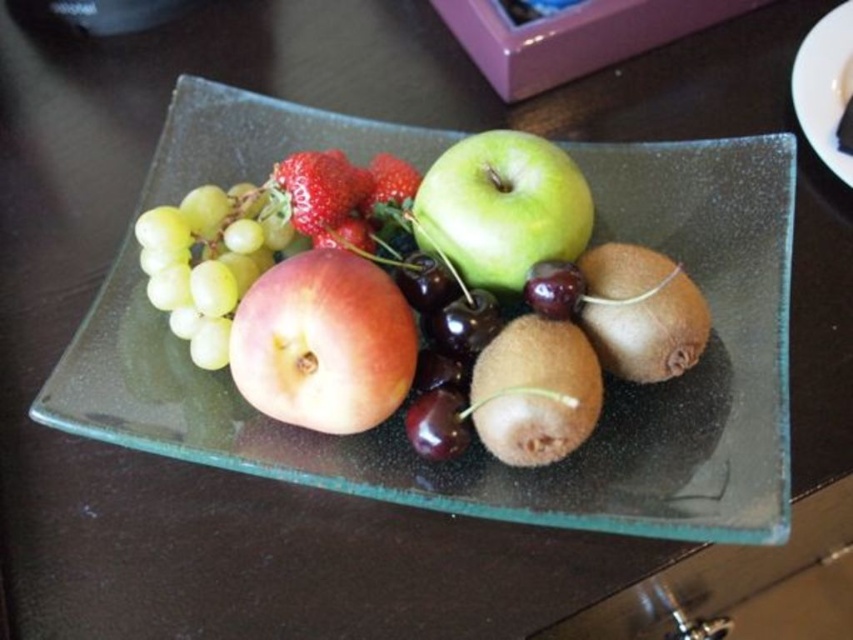
Question: Which object is closer to the camera taking this photo?

Choices:
 (A) brown fuzzy kiwi at center
 (B) transparent glass platter at center

Answer: (B)

Question: Is transparent glass platter at center smaller than red matte peach at center?

Choices:
 (A) yes
 (B) no

Answer: (B)

Question: Is red matte peach at center closer to camera compared to green matte grapes at upper left?

Choices:
 (A) yes
 (B) no

Answer: (A)

Question: Is green matte grapes at upper left thinner than brown fuzzy kiwi at center?

Choices:
 (A) no
 (B) yes

Answer: (A)

Question: Which point is farther from the camera taking this photo?

Choices:
 (A) (296, 483)
 (B) (646, 273)
 (C) (508, 236)

Answer: (C)

Question: Among these points, which one is farthest from the camera?

Choices:
 (A) (585, 268)
 (B) (459, 179)

Answer: (B)